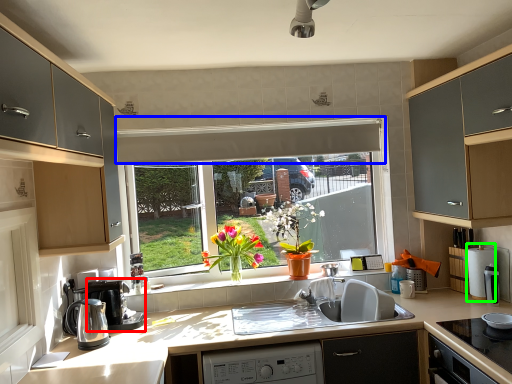
Question: Which object is the closest to the coffee machine (highlighted by a red box)? Choose among these: exhaust hood (highlighted by a blue box) or appliance (highlighted by a green box).

Choices:
 (A) exhaust hood
 (B) appliance

Answer: (A)